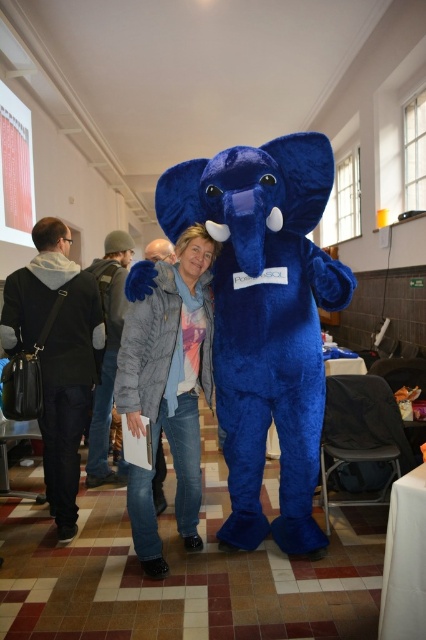
Question: Does blue plush elephant at center appear on the left side of gray quilted jacket at center?

Choices:
 (A) yes
 (B) no

Answer: (B)

Question: Can you confirm if blue plush elephant at center is smaller than gray quilted jacket at center?

Choices:
 (A) no
 (B) yes

Answer: (A)

Question: Is blue plush elephant at center closer to camera compared to gray quilted jacket at center?

Choices:
 (A) no
 (B) yes

Answer: (B)

Question: Which point is farther from the camera taking this photo?

Choices:
 (A) (282, 294)
 (B) (155, 416)

Answer: (A)